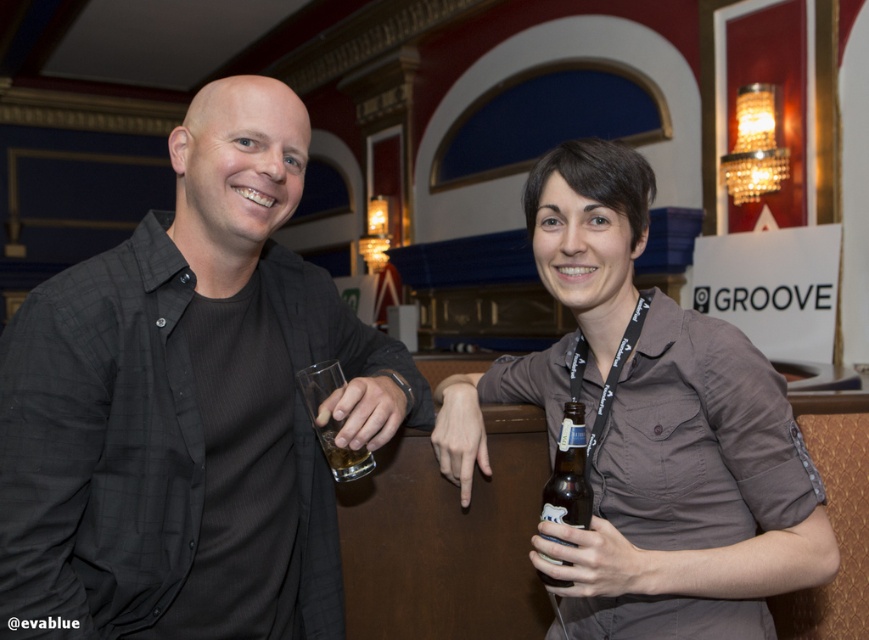
Who is more forward, (483, 401) or (566, 467)?

Positioned in front is point (566, 467).

Is point (718, 612) farther from viewer compared to point (572, 500)?

Yes, it is.

Identify the location of matte brown shirt at center. (649, 428).

Is brown glass bottle at lower center positioned in front of translucent glass at hand left?

Yes, brown glass bottle at lower center is in front of translucent glass at hand left.

Between point (574, 492) and point (333, 420), which one is positioned in front?

Point (574, 492)

This screenshot has height=640, width=869. I want to click on brown glass bottle at lower center, so click(x=569, y=474).

Does matte black shirt at center appear on the right side of matte brown shirt at center?

Incorrect, matte black shirt at center is not on the right side of matte brown shirt at center.

What do you see at coordinates (189, 406) in the screenshot? I see `matte black shirt at center` at bounding box center [189, 406].

Locate an element on the screen. This screenshot has width=869, height=640. matte black shirt at center is located at coordinates (189, 406).